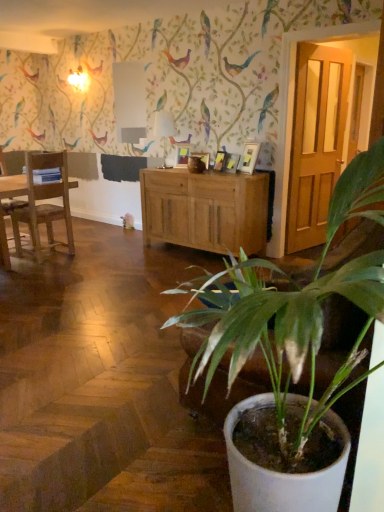
Question: Is white glossy lampshade at center located within wooden picture frame at center, positioned as the second picture frame in back-to-front order?

Choices:
 (A) no
 (B) yes

Answer: (A)

Question: From the image's perspective, is wooden picture frame at center, positioned as the second picture frame in back-to-front order, over white glossy lampshade at center?

Choices:
 (A) no
 (B) yes

Answer: (A)

Question: From a real-world perspective, is wooden picture frame at center, positioned as the second picture frame in back-to-front order, located higher than white glossy lampshade at center?

Choices:
 (A) no
 (B) yes

Answer: (A)

Question: Is wooden picture frame at center, positioned as the second picture frame in back-to-front order, oriented away from white glossy lampshade at center?

Choices:
 (A) yes
 (B) no

Answer: (B)

Question: Is wooden picture frame at center, which appears as the second picture frame when viewed from the right, positioned behind white glossy lampshade at center?

Choices:
 (A) no
 (B) yes

Answer: (A)

Question: Is wooden picture frame at center, positioned as the second picture frame in back-to-front order, not inside white glossy lampshade at center?

Choices:
 (A) no
 (B) yes

Answer: (B)

Question: Does white glossy picture frame at upper center, which is the third picture frame in back-to-front order, have a smaller size compared to light brown wood cabinet at center?

Choices:
 (A) yes
 (B) no

Answer: (A)

Question: Does white glossy picture frame at upper center, arranged as the third picture frame when viewed from the left, turn towards light brown wood cabinet at center?

Choices:
 (A) no
 (B) yes

Answer: (A)

Question: Does white glossy picture frame at upper center, arranged as the third picture frame when viewed from the left, come behind light brown wood cabinet at center?

Choices:
 (A) no
 (B) yes

Answer: (B)

Question: From the image's perspective, would you say white glossy picture frame at upper center, arranged as the third picture frame when viewed from the left, is shown under light brown wood cabinet at center?

Choices:
 (A) yes
 (B) no

Answer: (B)

Question: From the image's perspective, is white glossy picture frame at upper center, which is the third picture frame in back-to-front order, on light brown wood cabinet at center?

Choices:
 (A) yes
 (B) no

Answer: (A)

Question: Is white glossy picture frame at upper center, which is the 1th picture frame in front-to-back order, shorter than matte wooden picture frame at center, acting as the 1th picture frame starting from the left?

Choices:
 (A) yes
 (B) no

Answer: (B)